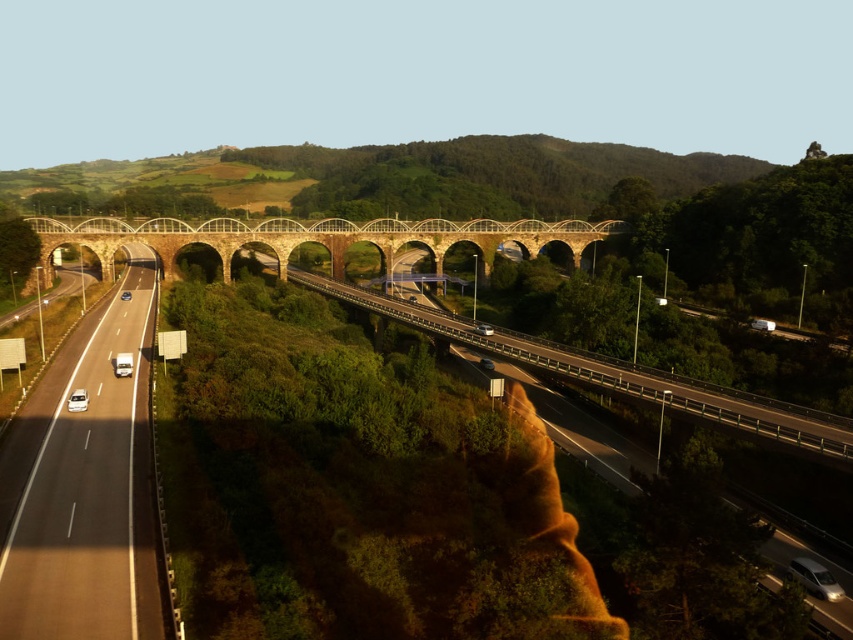
Question: Is stone arch bridge at center wider than white glossy car at center-left?

Choices:
 (A) no
 (B) yes

Answer: (B)

Question: Which point is closer to the camera?

Choices:
 (A) (86, 408)
 (B) (25, 595)
 (C) (129, 371)

Answer: (B)

Question: Is smooth asphalt highway at left positioned before white glossy car at center-left?

Choices:
 (A) no
 (B) yes

Answer: (B)

Question: Among these objects, which one is nearest to the camera?

Choices:
 (A) stone arch bridge at center
 (B) white glossy car at lower left

Answer: (B)

Question: Is the position of smooth asphalt highway at left more distant than that of stone arch bridge at center?

Choices:
 (A) yes
 (B) no

Answer: (B)

Question: Among these objects, which one is farthest from the camera?

Choices:
 (A) stone arch bridge at center
 (B) white glossy car at lower left

Answer: (A)